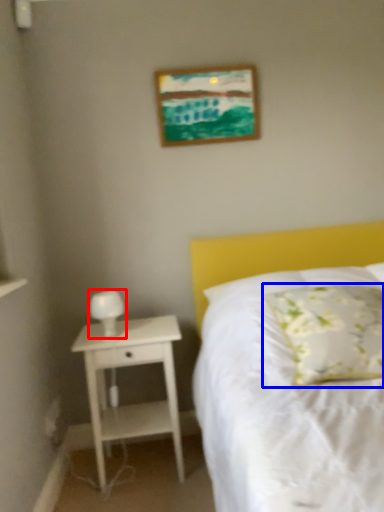
Question: Which object is further to the camera taking this photo, bedside lamp (highlighted by a red box) or pillow (highlighted by a blue box)?

Choices:
 (A) bedside lamp
 (B) pillow

Answer: (A)